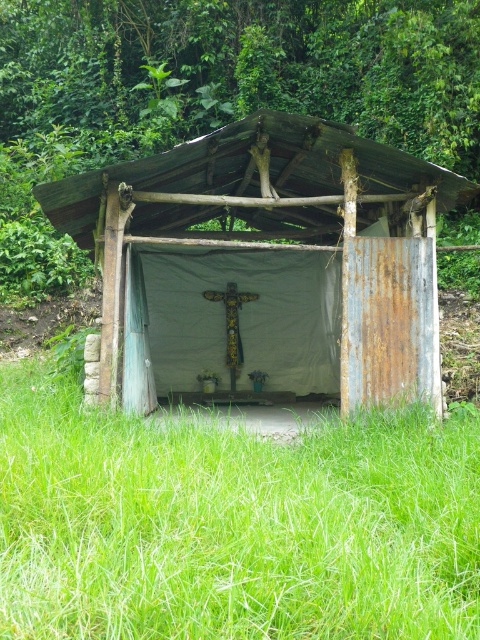
In the scene shown: Is green grass at lower center thinner than rusty metal hut at center?

In fact, green grass at lower center might be wider than rusty metal hut at center.

Which of these two, green grass at lower center or rusty metal hut at center, stands taller?

Standing taller between the two is green grass at lower center.

Who is more distant from viewer, (289,472) or (251,330)?

Positioned behind is point (251,330).

At what (x,y) coordinates should I click in order to perform the action: click on green grass at lower center. Please return your answer as a coordinate pair (x, y). Image resolution: width=480 pixels, height=640 pixels. Looking at the image, I should click on (231, 524).